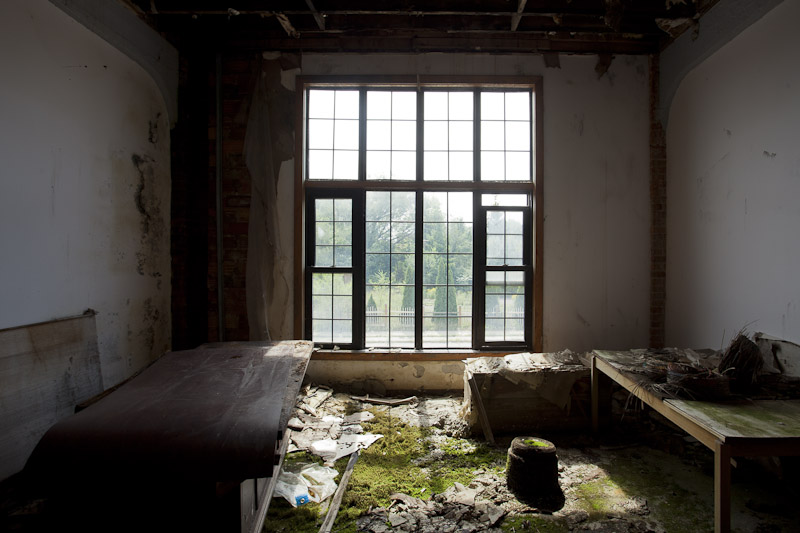
The width and height of the screenshot is (800, 533). Identify the location of bottom of window. (410, 354).